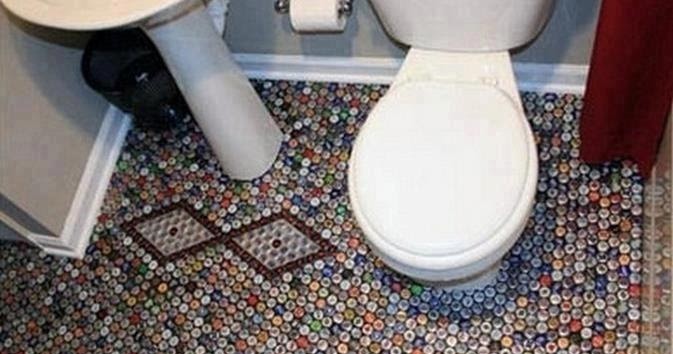
The width and height of the screenshot is (673, 354). Identify the location of floorboard molding. (96, 177).